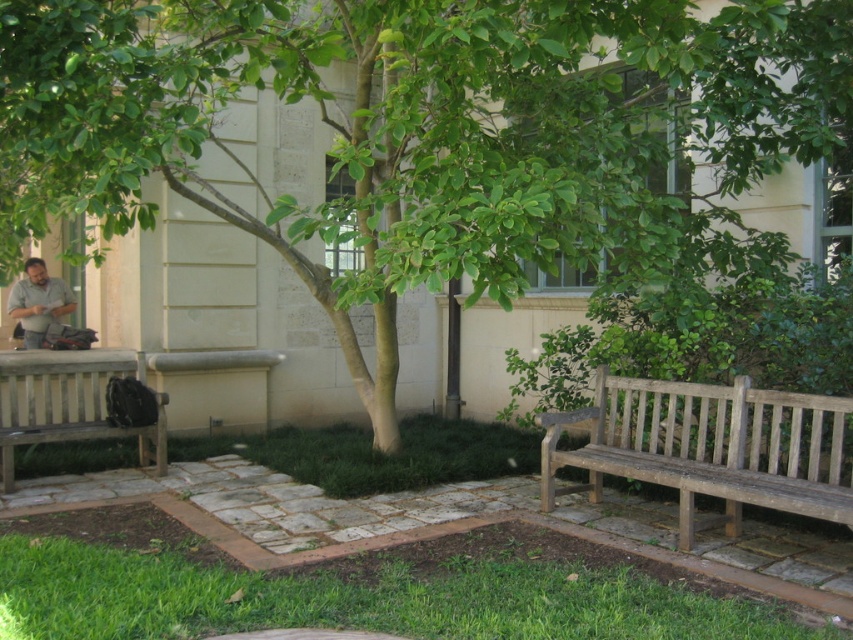
Question: Does weathered wood bench at lower right appear under matte gray shirt at left?

Choices:
 (A) no
 (B) yes

Answer: (B)

Question: Does green leafy tree at center have a lesser width compared to matte gray shirt at left?

Choices:
 (A) yes
 (B) no

Answer: (B)

Question: Does green leafy tree at center appear on the right side of wooden bench at left?

Choices:
 (A) no
 (B) yes

Answer: (B)

Question: Which of the following is the farthest from the observer?

Choices:
 (A) (144, 61)
 (B) (22, 323)

Answer: (B)

Question: Which point appears farthest from the camera in this image?

Choices:
 (A) [x=24, y=323]
 (B) [x=531, y=60]
 (C) [x=26, y=372]

Answer: (A)

Question: Which point appears farthest from the camera in this image?

Choices:
 (A) (618, 472)
 (B) (42, 260)
 (C) (144, 426)
 (D) (422, 99)

Answer: (B)